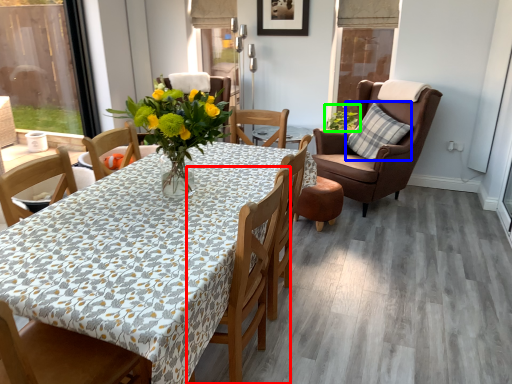
Question: Estimate the real-world distances between objects in this image. Which object is farther from chair (highlighted by a red box), pillow (highlighted by a blue box) or houseplant (highlighted by a green box)?

Choices:
 (A) pillow
 (B) houseplant

Answer: (B)